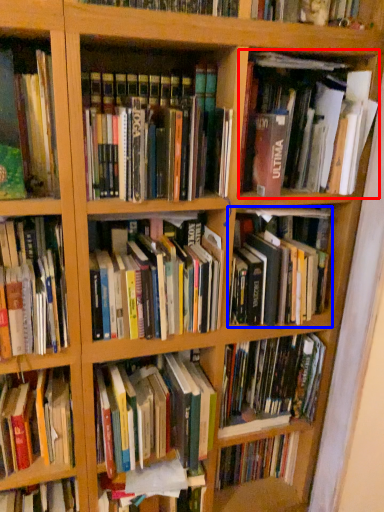
Question: Which object is further to the camera taking this photo, book (highlighted by a red box) or book (highlighted by a blue box)?

Choices:
 (A) book
 (B) book

Answer: (B)